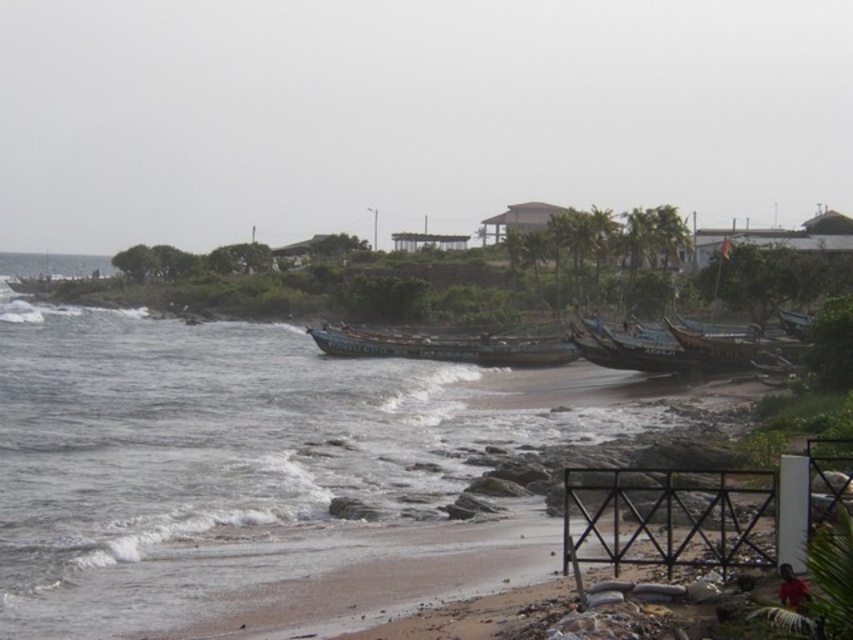
Question: Which point is closer to the camera?

Choices:
 (A) (432, 438)
 (B) (471, 342)

Answer: (A)

Question: Which point is closer to the camera?

Choices:
 (A) blue water at lower left
 (B) green painted wooden boat at center

Answer: (A)

Question: Can you confirm if blue water at lower left is bigger than green painted wooden boat at center?

Choices:
 (A) no
 (B) yes

Answer: (B)

Question: Can you confirm if blue water at lower left is positioned to the right of green painted wooden boat at center?

Choices:
 (A) yes
 (B) no

Answer: (B)

Question: Is blue water at lower left positioned in front of green painted wooden boat at center?

Choices:
 (A) no
 (B) yes

Answer: (B)